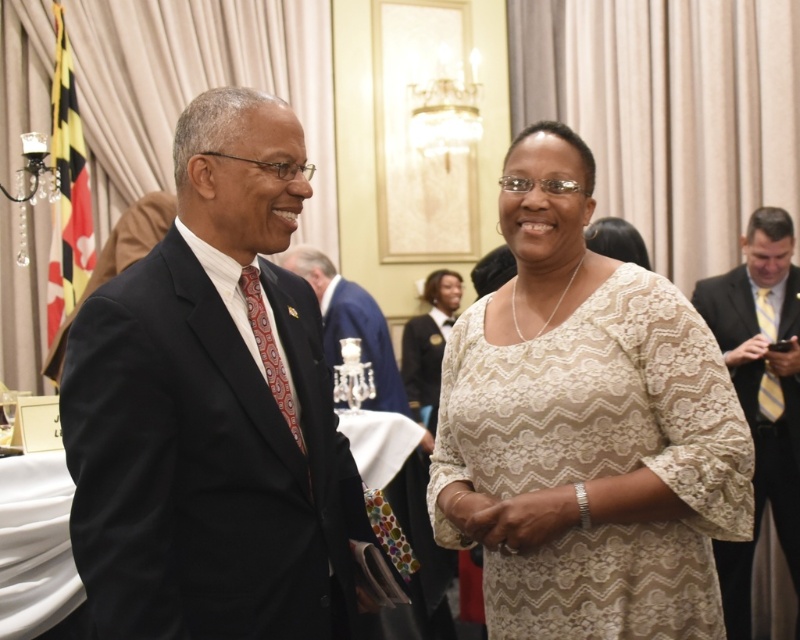
You are a photographer at this event and want to capture a clear photo of both the lace dress at center and the matte black suit at center. Since you can only focus on one subject at a time, which one should you focus on to ensure the other is still somewhat in focus?

You should focus on the lace dress at center because it is closer to the viewer than the matte black suit at center, so focusing on it will keep the matte black suit at center in better focus compared to focusing on the farther one.